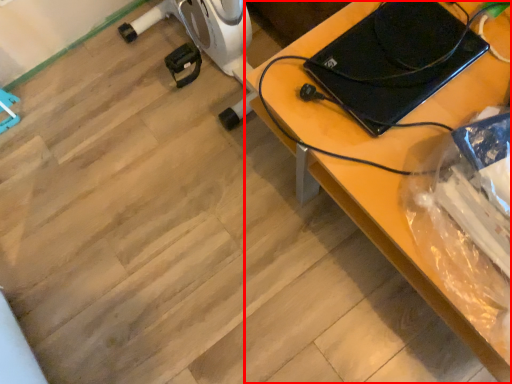
Question: From the image's perspective, considering the relative positions of desk (annotated by the red box) and laptop in the image provided, where is desk (annotated by the red box) located with respect to the staircase?

Choices:
 (A) below
 (B) above

Answer: (A)